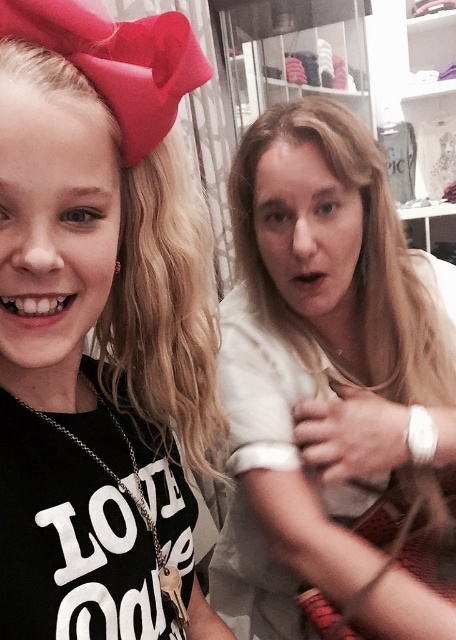
Is white matte shirt at center to the right of blonde curly hair at upper left from the viewer's perspective?

Correct, you'll find white matte shirt at center to the right of blonde curly hair at upper left.

Between white matte shirt at center and blonde curly hair at upper left, which one appears on the left side from the viewer's perspective?

blonde curly hair at upper left is more to the left.

Does point (440, 403) come behind point (138, 308)?

Yes, it is.

Locate an element on the screen. The height and width of the screenshot is (640, 456). white matte shirt at center is located at coordinates (332, 394).